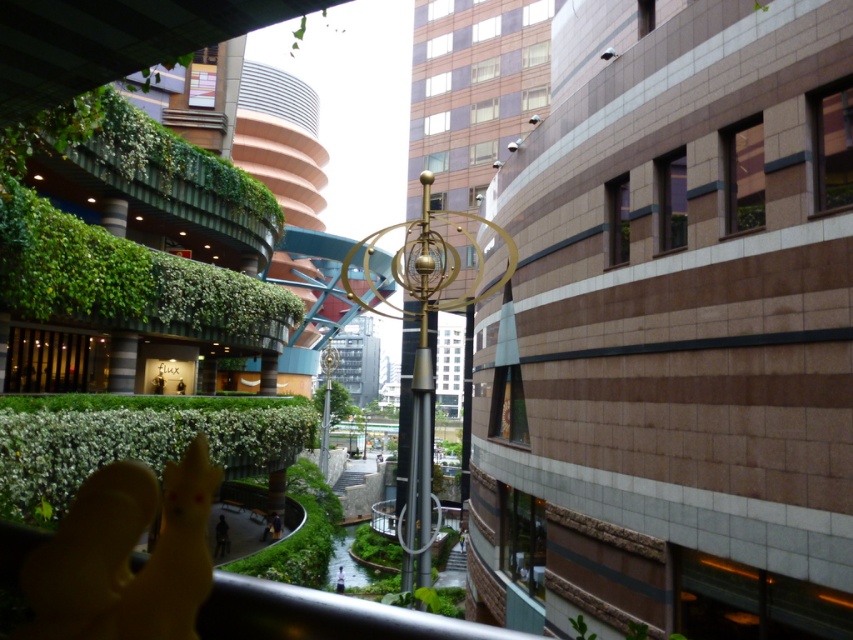
Can you confirm if green leafy hedge at lower left is taller than black matte person at center?

Yes.

Is green leafy hedge at lower left positioned in front of black matte person at center?

Yes, green leafy hedge at lower left is in front of black matte person at center.

I want to click on green leafy hedge at lower left, so click(x=134, y=440).

Between green leafy hedge at left and green leafy hedge at lower left, which one has less height?

green leafy hedge at left is shorter.

Is green leafy hedge at left taller than green leafy hedge at lower left?

No, green leafy hedge at left is not taller than green leafy hedge at lower left.

What do you see at coordinates (119, 275) in the screenshot? The width and height of the screenshot is (853, 640). I see `green leafy hedge at left` at bounding box center [119, 275].

Where is `green leafy hedge at left`? The image size is (853, 640). green leafy hedge at left is located at coordinates (119, 275).

Does green leafy hedge at lower left have a lesser height compared to light blue fabric person at center?

In fact, green leafy hedge at lower left may be taller than light blue fabric person at center.

You are a GUI agent. You are given a task and a screenshot of the screen. Output one action in this format:
    pyautogui.click(x=<x>, y=<y>)
    Task: Click on the green leafy hedge at lower left
    The image size is (853, 640).
    Given the screenshot: What is the action you would take?
    pyautogui.click(x=134, y=440)

Find the location of a particular element. The width and height of the screenshot is (853, 640). green leafy hedge at lower left is located at coordinates (134, 440).